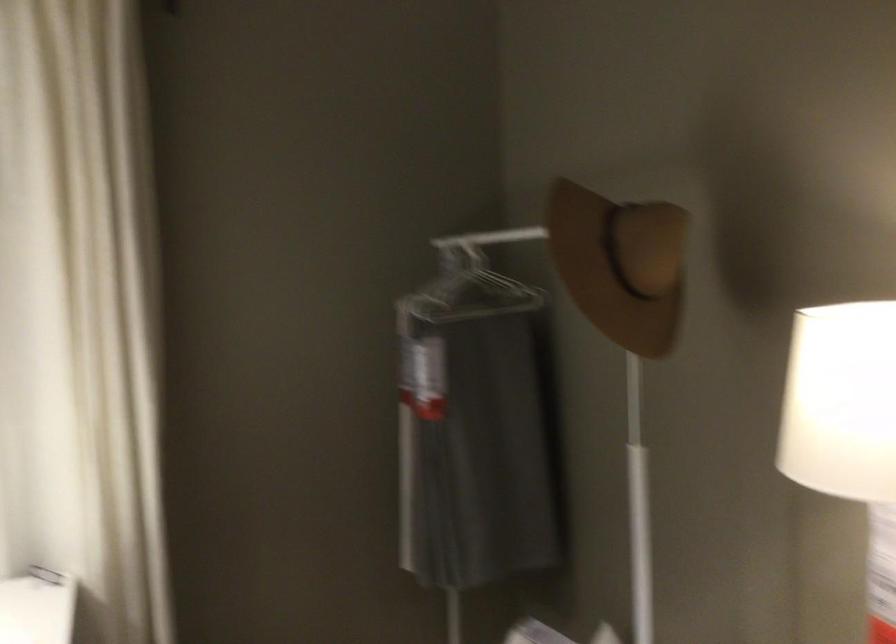
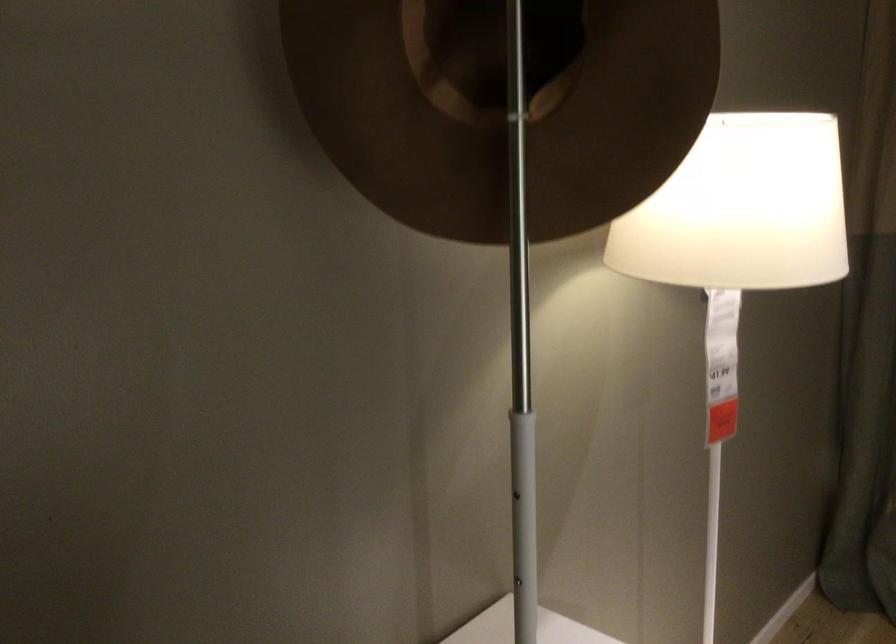
In the second image, find the point that corresponds to (635,496) in the first image.

(522, 503)